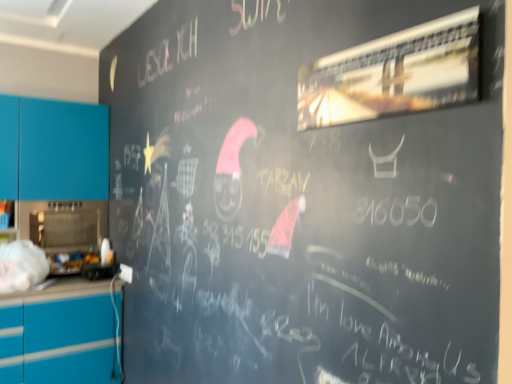
Question: Is point [99, 175] closer or farther from the camera than point [321, 112]?

Choices:
 (A) farther
 (B) closer

Answer: (A)

Question: Based on their positions, is teal matte cabinet at left located to the left or right of metallic reflective sign at upper right?

Choices:
 (A) left
 (B) right

Answer: (A)

Question: In terms of width, does teal matte cabinet at left look wider or thinner when compared to metallic reflective sign at upper right?

Choices:
 (A) thin
 (B) wide

Answer: (B)

Question: Does point (436, 74) appear closer or farther from the camera than point (106, 173)?

Choices:
 (A) closer
 (B) farther

Answer: (A)

Question: Is metallic reflective sign at upper right inside the boundaries of teal matte cabinet at left, or outside?

Choices:
 (A) outside
 (B) inside

Answer: (A)

Question: Based on their sizes in the image, would you say metallic reflective sign at upper right is bigger or smaller than teal matte cabinet at left?

Choices:
 (A) small
 (B) big

Answer: (A)

Question: From a real-world perspective, is metallic reflective sign at upper right above or below teal matte cabinet at left?

Choices:
 (A) below
 (B) above

Answer: (B)